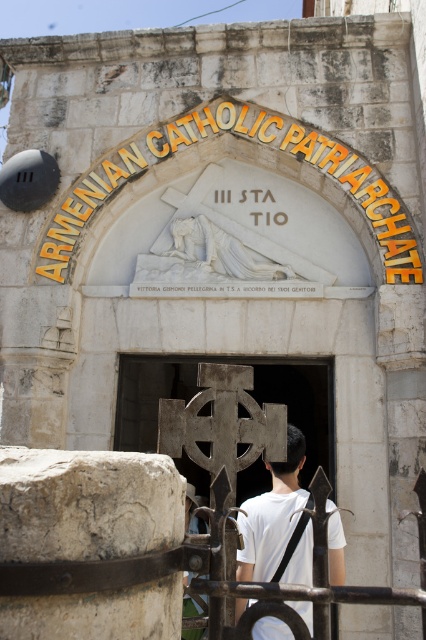
Question: Which object is farther from the camera taking this photo?

Choices:
 (A) white matte shirt at center
 (B) white stone relief at upper center

Answer: (B)

Question: Can you confirm if white stone relief at upper center is positioned below white matte shirt at center?

Choices:
 (A) no
 (B) yes

Answer: (A)

Question: Considering the relative positions of white stone relief at upper center and white matte shirt at center in the image provided, where is white stone relief at upper center located with respect to white matte shirt at center?

Choices:
 (A) below
 (B) above

Answer: (B)

Question: Can you confirm if white stone relief at upper center is positioned to the right of white matte shirt at center?

Choices:
 (A) no
 (B) yes

Answer: (A)